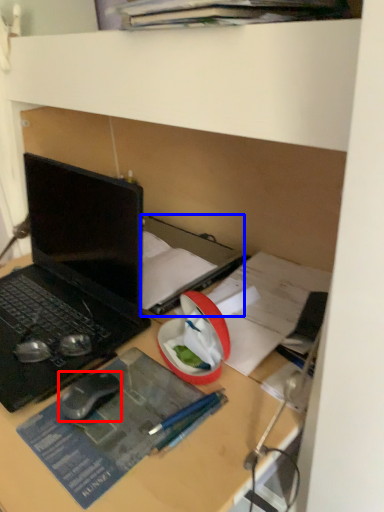
Question: Which point is closer to the camera, mouse (highlighted by a red box) or book (highlighted by a blue box)?

Choices:
 (A) mouse
 (B) book

Answer: (A)